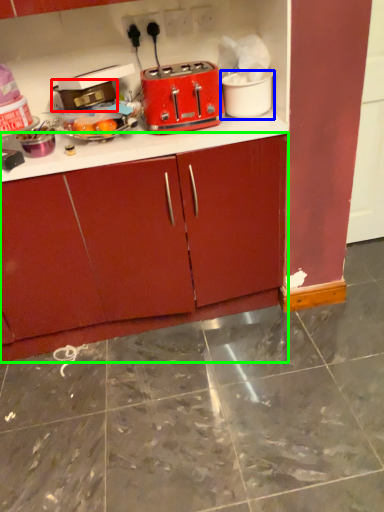
Question: Based on their relative distances, which object is farther from appliance (highlighted by a red box)? Choose from appliance (highlighted by a blue box) and cabinetry (highlighted by a green box).

Choices:
 (A) appliance
 (B) cabinetry

Answer: (B)